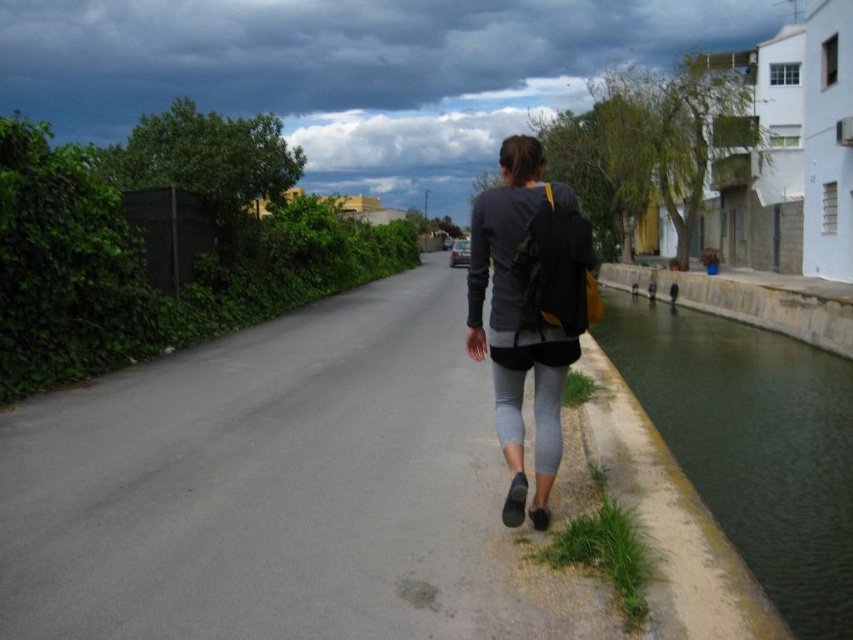
Question: Which point is closer to the camera?

Choices:
 (A) gray matte leggings at center
 (B) green concrete canal at right
 (C) gray asphalt road at center

Answer: (B)

Question: Among these objects, which one is nearest to the camera?

Choices:
 (A) green concrete canal at right
 (B) gray matte leggings at center
 (C) gray asphalt road at center

Answer: (A)

Question: Observing the image, what is the correct spatial positioning of green concrete canal at right in reference to gray matte leggings at center?

Choices:
 (A) below
 (B) above

Answer: (A)

Question: Is gray asphalt road at center to the right of gray matte leggings at center from the viewer's perspective?

Choices:
 (A) yes
 (B) no

Answer: (B)

Question: Can you confirm if green concrete canal at right is wider than gray matte leggings at center?

Choices:
 (A) yes
 (B) no

Answer: (A)

Question: Which object is closer to the camera taking this photo?

Choices:
 (A) gray matte leggings at center
 (B) green concrete canal at right
 (C) gray asphalt road at center

Answer: (B)